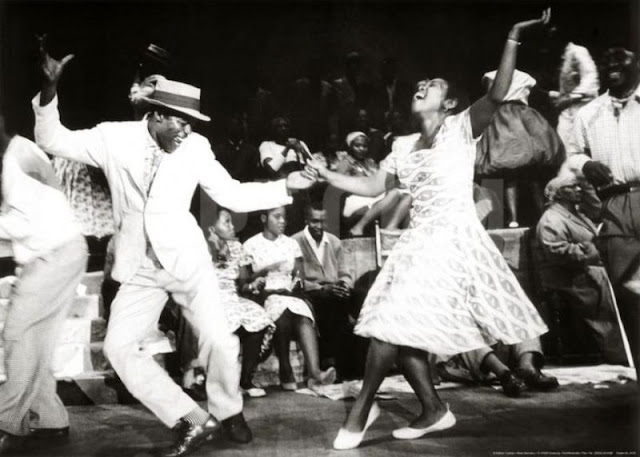
At what (x,y) coordinates should I click in order to perform the action: click on gym floor. Please return your answer as a coordinate pair (x, y). Looking at the image, I should click on (308, 424).